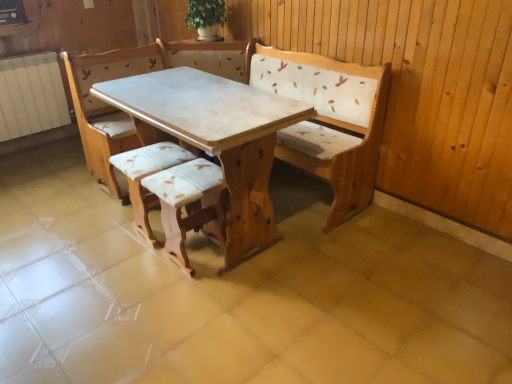
The width and height of the screenshot is (512, 384). In order to click on vacant region to the left of matte white cushioned stool at center, which is the second armchair in right-to-left order in this screenshot , I will do 105,231.